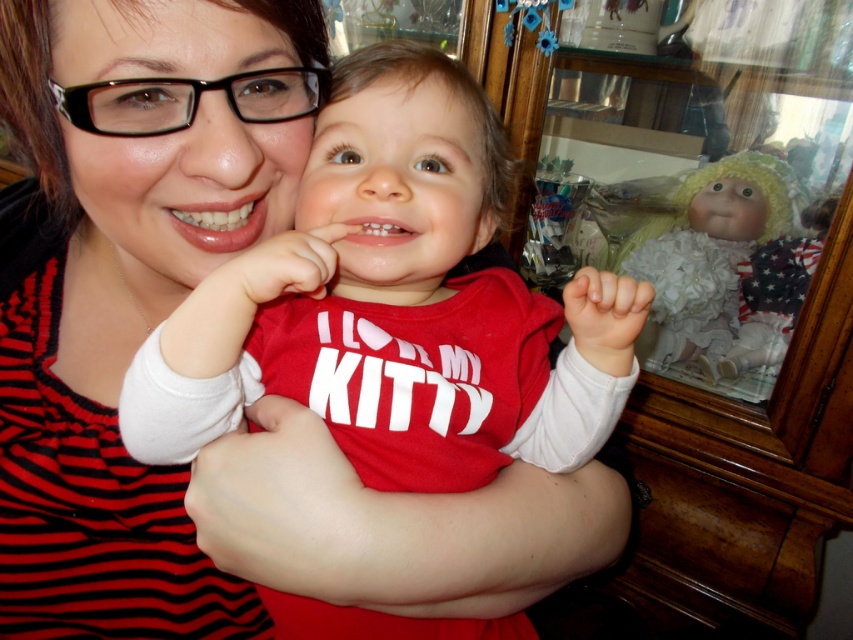
Question: Is matte black glasses at upper left above white fluffy doll at right?

Choices:
 (A) yes
 (B) no

Answer: (B)

Question: Among these points, which one is nearest to the camera?

Choices:
 (A) pyautogui.click(x=33, y=100)
 (B) pyautogui.click(x=779, y=360)

Answer: (A)

Question: Is matte red shirt at center below white fluffy doll at right?

Choices:
 (A) yes
 (B) no

Answer: (A)

Question: Among these points, which one is nearest to the camera?

Choices:
 (A) (706, 369)
 (B) (238, 58)
 (C) (364, 154)

Answer: (B)

Question: Which of the following is the closest to the observer?

Choices:
 (A) (115, 333)
 (B) (332, 316)

Answer: (B)

Question: Is matte red shirt at center below matte black glasses at upper left?

Choices:
 (A) yes
 (B) no

Answer: (A)